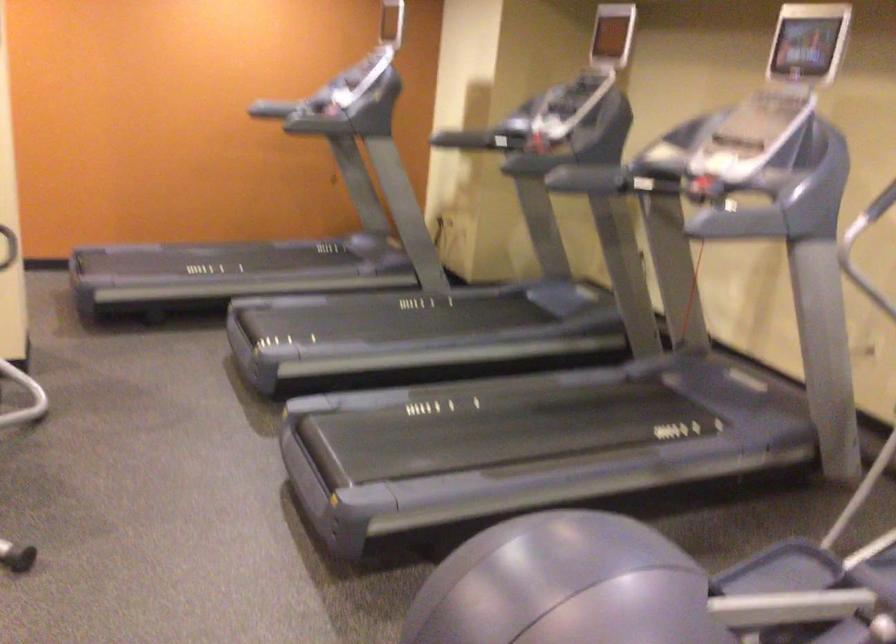
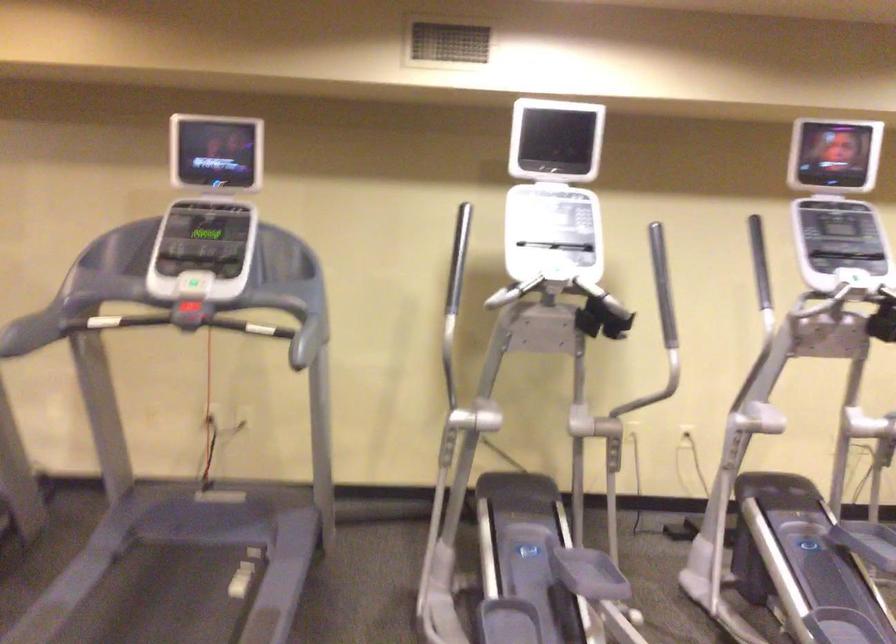
Locate, in the second image, the point that corresponds to point 683,191 in the first image.

(187, 321)